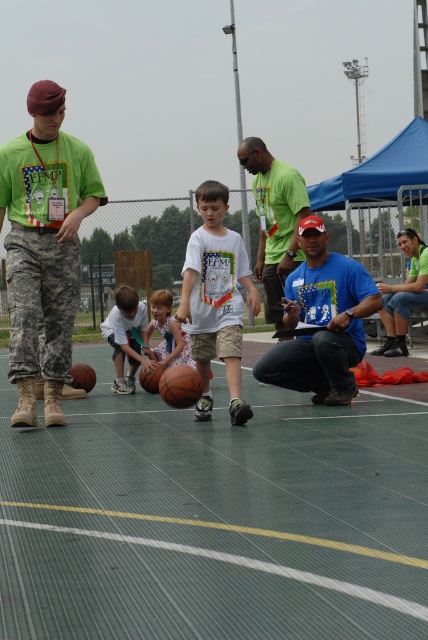
Does white matte t-shirt at center have a lesser height compared to floral dress at center?

Incorrect, white matte t-shirt at center's height does not fall short of floral dress at center's.

At what (x,y) coordinates should I click in order to perform the action: click on white matte t-shirt at center. Please return your answer as a coordinate pair (x, y). This screenshot has height=640, width=428. Looking at the image, I should click on [x=216, y=298].

You are a GUI agent. You are given a task and a screenshot of the screen. Output one action in this format:
    pyautogui.click(x=<x>, y=<y>)
    Task: Click on the white matte t-shirt at center
    The height and width of the screenshot is (640, 428).
    Given the screenshot: What is the action you would take?
    (x=216, y=298)

You are a GUI agent. You are given a task and a screenshot of the screen. Output one action in this format:
    pyautogui.click(x=<x>, y=<y>)
    Task: Click on the white matte t-shirt at center
    The height and width of the screenshot is (640, 428).
    Given the screenshot: What is the action you would take?
    pyautogui.click(x=216, y=298)

Is white matte t-shirt at center to the left of rubber/glossy basketball at center from the viewer's perspective?

No, white matte t-shirt at center is not to the left of rubber/glossy basketball at center.

Does point (199, 339) lie behind point (187, 371)?

Yes.

The height and width of the screenshot is (640, 428). What are the coordinates of `white matte t-shirt at center` in the screenshot? It's located at click(216, 298).

Does point (55, 364) come farther from viewer compared to point (166, 368)?

That is False.

Does camouflage pants at left have a larger size compared to rubber/glossy basketball at center?

Yes, camouflage pants at left is bigger than rubber/glossy basketball at center.

Between point (55, 116) and point (178, 401), which one is positioned behind?

Point (178, 401)

At what (x,y) coordinates should I click in order to perform the action: click on camouflage pants at left. Please return your answer as a coordinate pair (x, y). This screenshot has height=640, width=428. Looking at the image, I should click on (44, 248).